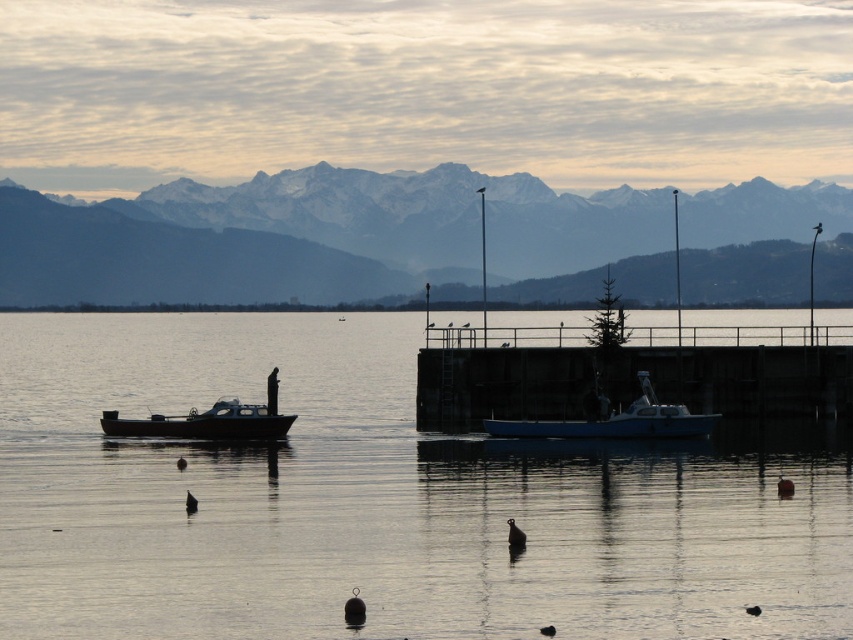
Between blue matte boat at center and wooden boat at left, which one appears on the left side from the viewer's perspective?

wooden boat at left

Is blue matte boat at center closer to camera compared to wooden boat at left?

That is False.

Which is in front, point (695, 417) or point (189, 413)?

Positioned in front is point (695, 417).

Identify the location of blue matte boat at center. The image size is (853, 640). (614, 420).

Which is below, smooth water at center or blue matte boat at center?

blue matte boat at center is below.

Is point (202, 548) positioned in front of point (642, 433)?

Yes, point (202, 548) is in front of point (642, 433).

Who is more distant from viewer, (399, 339) or (604, 420)?

The point (399, 339) is more distant.

Identify the location of smooth water at center. This screenshot has width=853, height=640. (381, 500).

Between smooth concrete dock at center and blue matte boat at center, which one is positioned lower?

blue matte boat at center

Consider the image. Which is more to the right, smooth concrete dock at center or blue matte boat at center?

smooth concrete dock at center is more to the right.

The image size is (853, 640). I want to click on smooth concrete dock at center, so click(x=633, y=372).

Where is `smooth concrete dock at center`? smooth concrete dock at center is located at coordinates (633, 372).